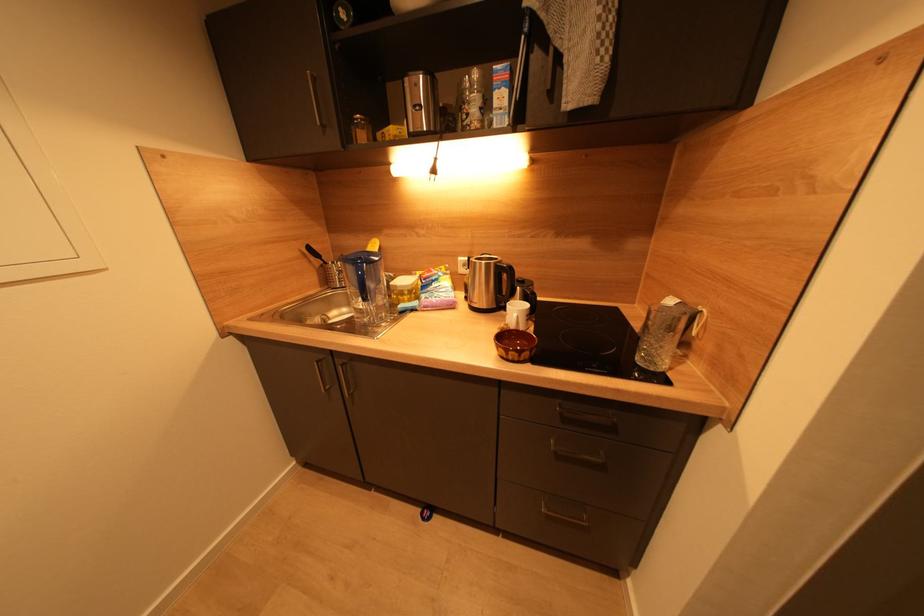
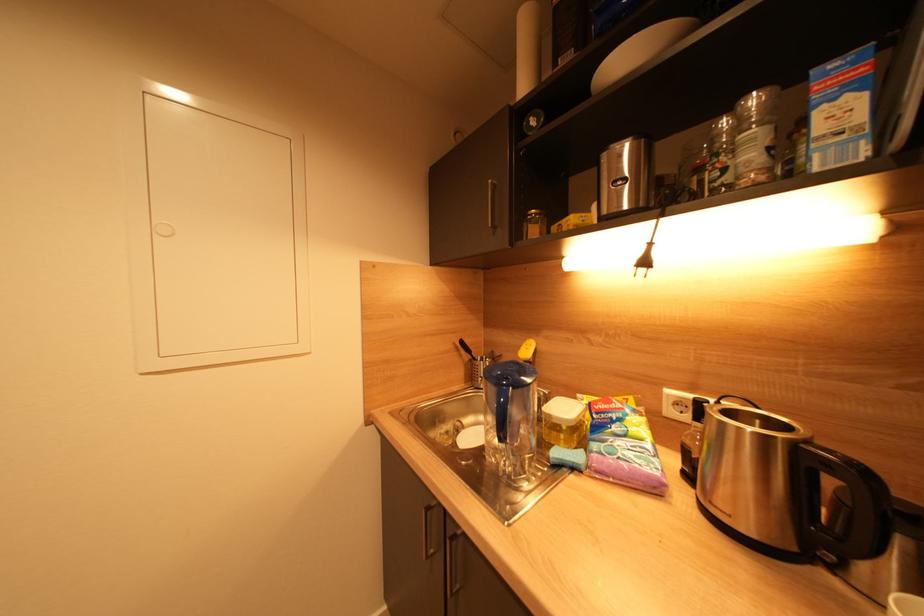
Question: The images are taken continuously from a first-person perspective. In which direction is your viewpoint rotating?

Choices:
 (A) Left
 (B) Right
 (C) Up
 (D) Down

Answer: (A)